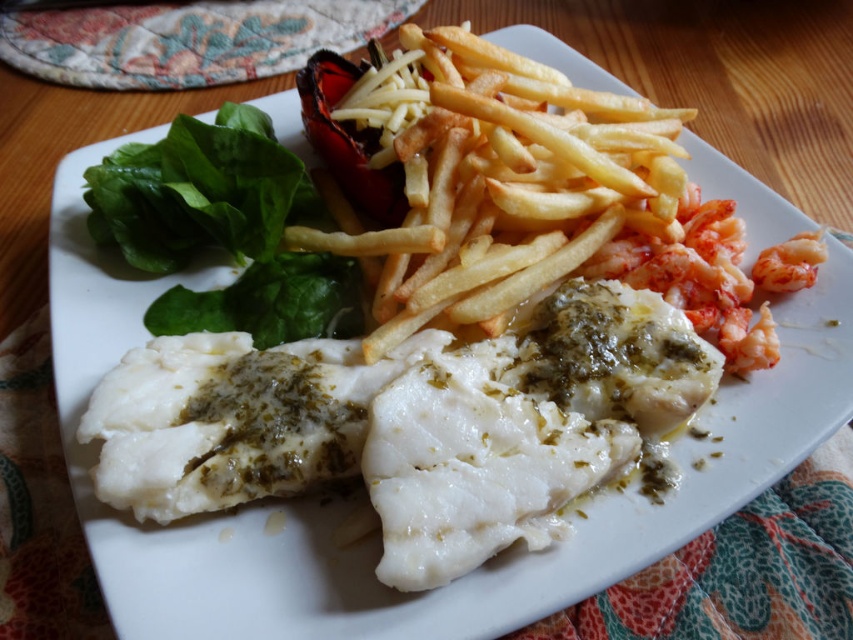
Which of these two, green leafy vegetable at upper left or translucent pink shrimp at upper right, stands shorter?

translucent pink shrimp at upper right

Is green leafy vegetable at upper left below translucent pink shrimp at upper right?

No, green leafy vegetable at upper left is not below translucent pink shrimp at upper right.

Between point (299, 208) and point (815, 269), which one is positioned behind?

Positioned behind is point (299, 208).

Locate an element on the screen. This screenshot has width=853, height=640. green leafy vegetable at upper left is located at coordinates (223, 228).

Does green leafy vegetable at upper left appear over shiny pink shrimp at right?

Yes.

Does point (352, 264) come behind point (749, 364)?

Yes, point (352, 264) is behind point (749, 364).

The height and width of the screenshot is (640, 853). What do you see at coordinates (223, 228) in the screenshot?
I see `green leafy vegetable at upper left` at bounding box center [223, 228].

Locate an element on the screen. Image resolution: width=853 pixels, height=640 pixels. green leafy vegetable at upper left is located at coordinates (223, 228).

Who is more distant from viewer, (718, 259) or (808, 266)?

Positioned behind is point (718, 259).

Does point (799, 262) come in front of point (799, 237)?

Yes, it is in front of point (799, 237).

Find the location of a particular element. Image resolution: width=853 pixels, height=640 pixels. shiny pink shrimp at right is located at coordinates (712, 275).